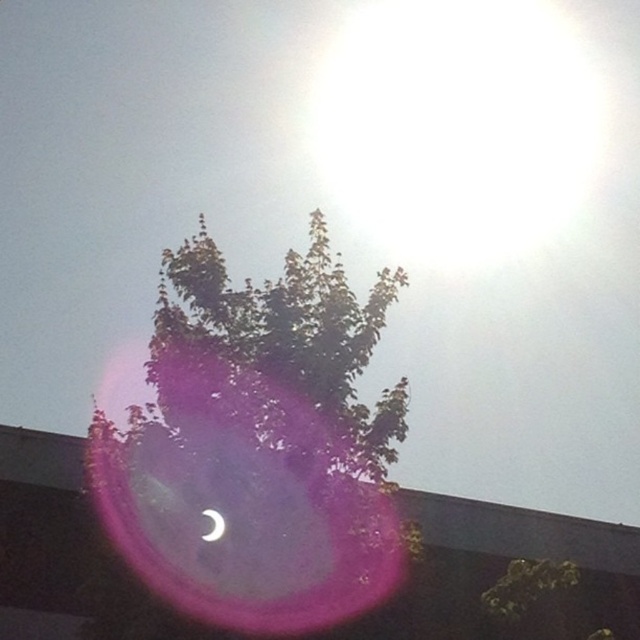
Question: Which of the following is the farthest from the observer?

Choices:
 (A) bright white disk at upper center
 (B) satin white crescent at upper center
 (C) green leafy tree at center

Answer: (A)

Question: Which object appears closest to the camera in this image?

Choices:
 (A) satin white crescent at upper center
 (B) green leafy tree at center

Answer: (B)

Question: Observing the image, what is the correct spatial positioning of green leafy tree at center in reference to satin white crescent at upper center?

Choices:
 (A) left
 (B) right

Answer: (B)

Question: Does green leafy tree at center have a greater width compared to satin white crescent at upper center?

Choices:
 (A) no
 (B) yes

Answer: (B)

Question: Is bright white disk at upper center bigger than satin white crescent at upper center?

Choices:
 (A) yes
 (B) no

Answer: (A)

Question: Which point appears closest to the camera in this image?

Choices:
 (A) (244, 586)
 (B) (484, 76)
 (C) (216, 540)

Answer: (A)